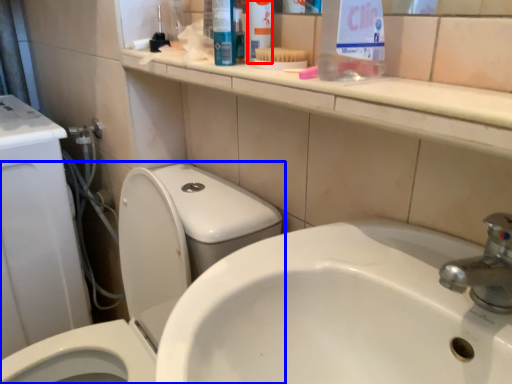
Question: Which object is closer to the camera taking this photo, toiletry (highlighted by a red box) or toilet (highlighted by a blue box)?

Choices:
 (A) toiletry
 (B) toilet

Answer: (B)